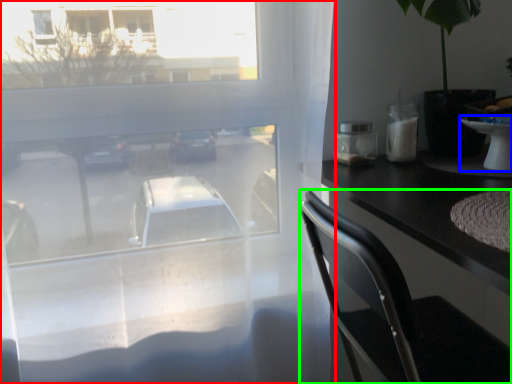
Question: Based on their relative distances, which object is nearer to window (highlighted by a red box)? Choose from table (highlighted by a blue box) and chair (highlighted by a green box).

Choices:
 (A) table
 (B) chair

Answer: (B)